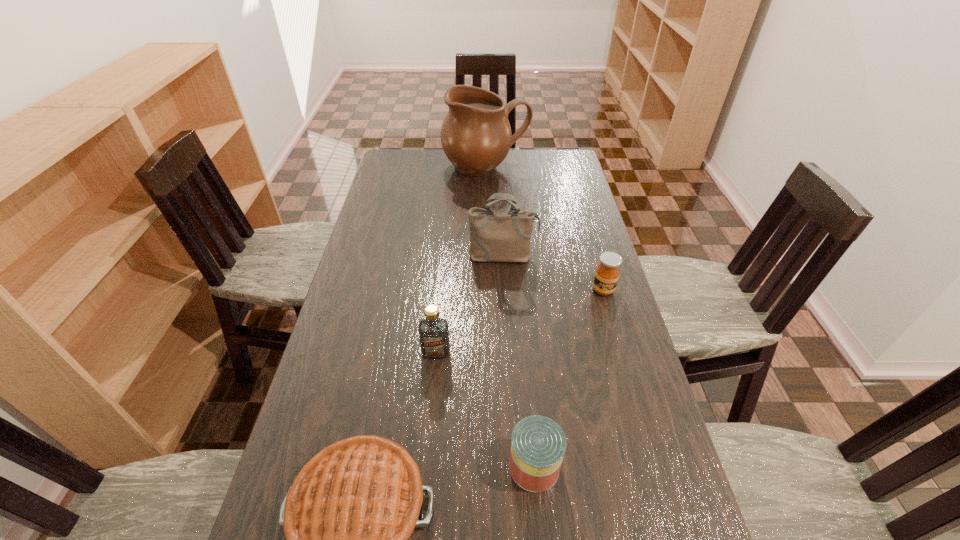
This screenshot has width=960, height=540. What are the coordinates of `vacant space located 0.070m on the front-facing side of the shoulder bag` in the screenshot? It's located at (504, 281).

At what (x,y) coordinates should I click in order to perform the action: click on free space located on the front-facing side of the fourth shortest object. Please return your answer as a coordinate pair (x, y). Looking at the image, I should click on (420, 528).

You are a GUI agent. You are given a task and a screenshot of the screen. Output one action in this format:
    pyautogui.click(x=<x>, y=<y>)
    Task: Click on the vacant space positioned on the front-facing side of the honey
    The height and width of the screenshot is (540, 960).
    Given the screenshot: What is the action you would take?
    pyautogui.click(x=634, y=395)

Where is `vacant area situated 0.080m on the back of the can`? vacant area situated 0.080m on the back of the can is located at coordinates (529, 410).

I want to click on object present at the far edge, so click(x=476, y=136).

Find the location of a particular element. The image size is (960, 540). object that is at the right edge is located at coordinates (607, 273).

Where is `vacant region at the far edge of the desktop`? This screenshot has height=540, width=960. vacant region at the far edge of the desktop is located at coordinates (504, 172).

The height and width of the screenshot is (540, 960). In order to click on vacant area at the left edge in this screenshot , I will do `click(410, 182)`.

In the image, there is a desktop. Where is `free space at the right edge`? free space at the right edge is located at coordinates (592, 259).

Locate an element on the screen. vacant area at the far left corner of the desktop is located at coordinates (388, 156).